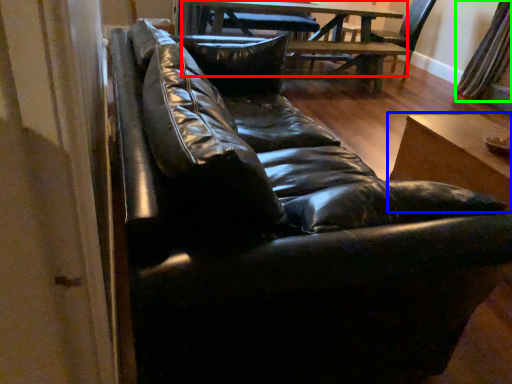
Question: Estimate the real-world distances between objects in this image. Which object is closer to table (highlighted by a red box), table (highlighted by a blue box) or curtain (highlighted by a green box)?

Choices:
 (A) table
 (B) curtain

Answer: (B)